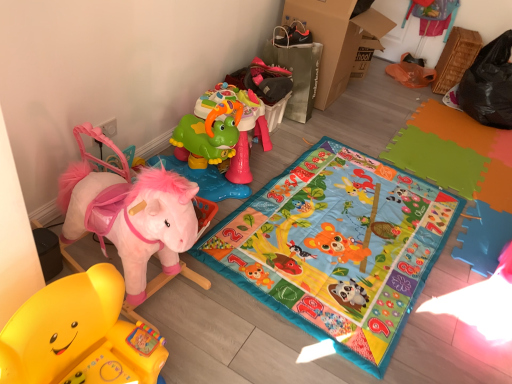
Find the location of `free region under multicolored fabric play mat at center (from a real-world perspective)`. free region under multicolored fabric play mat at center (from a real-world perspective) is located at coordinates (327, 232).